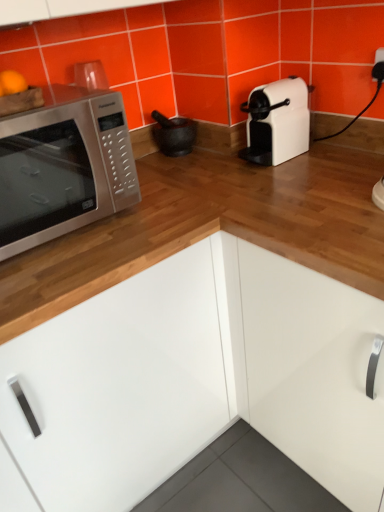
Question: From a real-world perspective, is white glossy cabinet at center physically below satin silver microwave at left?

Choices:
 (A) no
 (B) yes

Answer: (B)

Question: From a real-world perspective, is white glossy cabinet at center on satin silver microwave at left?

Choices:
 (A) yes
 (B) no

Answer: (B)

Question: Does white glossy cabinet at center have a larger size compared to satin silver microwave at left?

Choices:
 (A) yes
 (B) no

Answer: (A)

Question: Is white glossy cabinet at center smaller than satin silver microwave at left?

Choices:
 (A) no
 (B) yes

Answer: (A)

Question: Is white glossy cabinet at center outside of satin silver microwave at left?

Choices:
 (A) yes
 (B) no

Answer: (A)

Question: Is matte black mortar at center situated inside satin silver microwave at left or outside?

Choices:
 (A) inside
 (B) outside

Answer: (B)

Question: Is matte black mortar at center taller or shorter than satin silver microwave at left?

Choices:
 (A) tall
 (B) short

Answer: (B)

Question: In terms of size, does matte black mortar at center appear bigger or smaller than satin silver microwave at left?

Choices:
 (A) big
 (B) small

Answer: (B)

Question: Is matte black mortar at center to the left or to the right of satin silver microwave at left in the image?

Choices:
 (A) right
 (B) left

Answer: (A)

Question: Is white glossy cabinet at center wider or thinner than matte black mortar at center?

Choices:
 (A) wide
 (B) thin

Answer: (A)

Question: From their relative heights in the image, would you say white glossy cabinet at center is taller or shorter than matte black mortar at center?

Choices:
 (A) short
 (B) tall

Answer: (B)

Question: In terms of size, does white glossy cabinet at center appear bigger or smaller than matte black mortar at center?

Choices:
 (A) small
 (B) big

Answer: (B)

Question: From a real-world perspective, is white glossy cabinet at center positioned above or below matte black mortar at center?

Choices:
 (A) above
 (B) below

Answer: (B)

Question: In the image, is satin silver microwave at left positioned in front of or behind matte black mortar at center?

Choices:
 (A) front
 (B) behind

Answer: (A)

Question: Considering the positions of satin silver microwave at left and matte black mortar at center in the image, is satin silver microwave at left taller or shorter than matte black mortar at center?

Choices:
 (A) tall
 (B) short

Answer: (A)